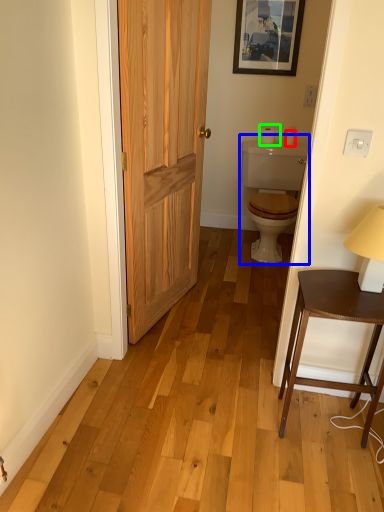
Question: Considering the real-world distances, which object is closest to toilet paper (highlighted by a red box)? sink (highlighted by a blue box) or toilet paper (highlighted by a green box).

Choices:
 (A) sink
 (B) toilet paper

Answer: (B)